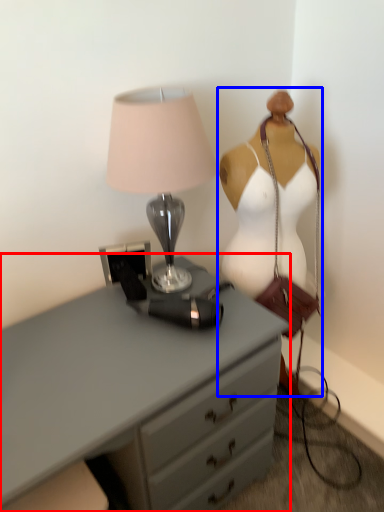
Question: Which object is closer to the camera taking this photo, chest of drawers (highlighted by a red box) or mannequin (highlighted by a blue box)?

Choices:
 (A) chest of drawers
 (B) mannequin

Answer: (A)